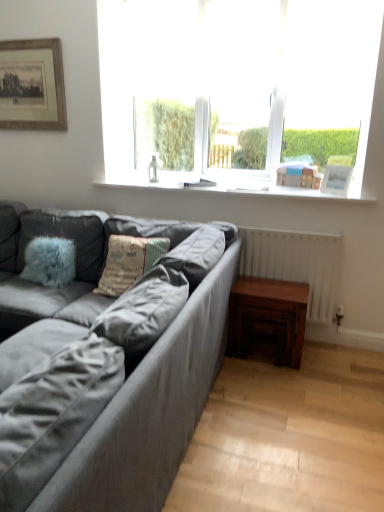
What do you see at coordinates (227, 187) in the screenshot? I see `white plastic window sill at upper center` at bounding box center [227, 187].

How much space does white glossy picture frame at upper right, the 1th picture frame when ordered from right to left, occupy horizontally?

8.96 centimeters.

Measure the distance between point (x=248, y=2) and camera.

Point (x=248, y=2) and camera are 9.29 feet apart from each other.

At what (x,y) coordinates should I click in order to perform the action: click on transparent glass window at upper center. Please return your answer as a coordinate pair (x, y). Looking at the image, I should click on (235, 75).

Image resolution: width=384 pixels, height=512 pixels. I want to click on white plastic window sill at upper center, so click(x=227, y=187).

Which object is further away from the camera taking this photo, textured fabric pillow at center or suede gray couch at left?

textured fabric pillow at center is behind.

Looking at this image, is suede gray couch at left surrounded by textured fabric pillow at center?

Definitely not — suede gray couch at left is not inside textured fabric pillow at center.

From the image's perspective, is suede gray couch at left beneath wooden framed print at upper left, which ranks as the 2th picture frame in front-to-back order?

Yes, from the image's perspective, suede gray couch at left is below wooden framed print at upper left, which ranks as the 2th picture frame in front-to-back order.

Is suede gray couch at left not close to wooden framed print at upper left, which ranks as the 2th picture frame in front-to-back order?

Yes, suede gray couch at left and wooden framed print at upper left, which ranks as the 2th picture frame in front-to-back order, are quite far apart.

Is suede gray couch at left facing away from wooden framed print at upper left, the 1th picture frame positioned from the left?

suede gray couch at left is not turned away from wooden framed print at upper left, the 1th picture frame positioned from the left.

What's the angular difference between suede gray couch at left and wooden framed print at upper left, the second picture frame positioned from the right,'s facing directions?

89.8 degrees.

From the image's perspective, is dark brown wooden table at lower right on white plastic window sill at upper center?

No, from the image's perspective, dark brown wooden table at lower right is not above white plastic window sill at upper center.

Is dark brown wooden table at lower right turned away from white plastic window sill at upper center?

No.

Are dark brown wooden table at lower right and white plastic window sill at upper center beside each other?

dark brown wooden table at lower right and white plastic window sill at upper center are clearly separated.

Considering the relative sizes of dark brown wooden table at lower right and white plastic window sill at upper center in the image provided, is dark brown wooden table at lower right wider than white plastic window sill at upper center?

No.

Considering the sizes of objects textured fabric pillow at center and dark brown wooden table at lower right in the image provided, who is wider, textured fabric pillow at center or dark brown wooden table at lower right?

With larger width is dark brown wooden table at lower right.

Which of these two, textured fabric pillow at center or dark brown wooden table at lower right, is smaller?

textured fabric pillow at center is smaller.

Is textured fabric pillow at center taller or shorter than dark brown wooden table at lower right?

In the image, textured fabric pillow at center appears to be taller than dark brown wooden table at lower right.

In terms of size, does white glossy picture frame at upper right, which is counted as the first picture frame, starting from the bottom, appear bigger or smaller than dark brown wooden table at lower right?

In the image, white glossy picture frame at upper right, which is counted as the first picture frame, starting from the bottom, appears to be smaller than dark brown wooden table at lower right.

Would you consider white glossy picture frame at upper right, the 1th picture frame when ordered from right to left, to be distant from dark brown wooden table at lower right?

No.

Considering the sizes of white glossy picture frame at upper right, which ranks as the 2th picture frame in left-to-right order, and dark brown wooden table at lower right in the image, is white glossy picture frame at upper right, which ranks as the 2th picture frame in left-to-right order, taller or shorter than dark brown wooden table at lower right?

Clearly, white glossy picture frame at upper right, which ranks as the 2th picture frame in left-to-right order, is shorter compared to dark brown wooden table at lower right.

Find the location of `table lying on the left of white glossy picture frame at upper right, marked as the first picture frame in a front-to-back arrangement`. table lying on the left of white glossy picture frame at upper right, marked as the first picture frame in a front-to-back arrangement is located at coordinates (268, 316).

Can you confirm if dark brown wooden table at lower right is wider than transparent glass window at upper center?

Yes, dark brown wooden table at lower right is wider than transparent glass window at upper center.

In the image, is dark brown wooden table at lower right on the left side or the right side of transparent glass window at upper center?

dark brown wooden table at lower right is positioned on transparent glass window at upper center's right side.

Based on the photo, what's the angular difference between dark brown wooden table at lower right and transparent glass window at upper center's facing directions?

0.853 degrees.

You are a GUI agent. You are given a task and a screenshot of the screen. Output one action in this format:
    pyautogui.click(x=<x>, y=<y>)
    Task: Click on the table that appears below the transparent glass window at upper center (from the image's perspective)
    The width and height of the screenshot is (384, 512).
    Given the screenshot: What is the action you would take?
    pyautogui.click(x=268, y=316)

Considering the sizes of objects transparent glass window at upper center and dark brown wooden table at lower right in the image provided, who is bigger, transparent glass window at upper center or dark brown wooden table at lower right?

With larger size is transparent glass window at upper center.

From a real-world perspective, which object rests below the other?

dark brown wooden table at lower right is physically lower.

Considering the sizes of transparent glass window at upper center and dark brown wooden table at lower right in the image, is transparent glass window at upper center taller or shorter than dark brown wooden table at lower right?

Considering their sizes, transparent glass window at upper center has more height than dark brown wooden table at lower right.

Where is `pillow above the suede gray couch at left (from a real-world perspective)`? Image resolution: width=384 pixels, height=512 pixels. pillow above the suede gray couch at left (from a real-world perspective) is located at coordinates (128, 262).

Locate an element on the screen. picture frame that is on the left side of suede gray couch at left is located at coordinates (x=32, y=85).

From the image, which object appears to be farther from transparent glass window at upper center, wooden framed print at upper left, the second picture frame positioned from the right, or suede gray couch at left?

Among the two, suede gray couch at left is located further to transparent glass window at upper center.

From the image, which object appears to be nearer to white plastic window sill at upper center, suede gray couch at left or wooden framed print at upper left, which is counted as the 1th picture frame, starting from the top?

wooden framed print at upper left, which is counted as the 1th picture frame, starting from the top.

Looking at the image, which one is located further to textured fabric pillow at center, white plastic window sill at upper center or white glossy picture frame at upper right, marked as the first picture frame in a front-to-back arrangement?

The object further to textured fabric pillow at center is white glossy picture frame at upper right, marked as the first picture frame in a front-to-back arrangement.

Looking at the image, which one is located further to white glossy picture frame at upper right, arranged as the 2th picture frame when viewed from the back, dark brown wooden table at lower right or white plastic window sill at upper center?

The object further to white glossy picture frame at upper right, arranged as the 2th picture frame when viewed from the back, is dark brown wooden table at lower right.

Based on their spatial positions, is white plastic window sill at upper center or textured fabric pillow at center closer to wooden framed print at upper left, which is counted as the 1th picture frame, starting from the top?

white plastic window sill at upper center.

Looking at the image, which one is located closer to white plastic window sill at upper center, wooden framed print at upper left, arranged as the second picture frame when ordered from the bottom, or textured fabric pillow at center?

The object closer to white plastic window sill at upper center is textured fabric pillow at center.

Considering their positions, is wooden framed print at upper left, arranged as the second picture frame when ordered from the bottom, positioned closer to transparent glass window at upper center than textured fabric pillow at center?

wooden framed print at upper left, arranged as the second picture frame when ordered from the bottom, lies closer to transparent glass window at upper center than the other object.

Looking at the image, which one is located closer to transparent glass window at upper center, wooden framed print at upper left, the 1th picture frame positioned from the left, or white plastic window sill at upper center?

white plastic window sill at upper center is positioned closer to the anchor transparent glass window at upper center.

The image size is (384, 512). I want to click on picture frame between transparent glass window at upper center and dark brown wooden table at lower right from top to bottom, so (x=336, y=179).

Locate an element on the screen. The height and width of the screenshot is (512, 384). table between suede gray couch at left and white plastic window sill at upper center from front to back is located at coordinates (268, 316).

Find the location of a particular element. The image size is (384, 512). pillow between wooden framed print at upper left, the second picture frame positioned from the right, and transparent glass window at upper center is located at coordinates (128, 262).

Where is `table between suede gray couch at left and transparent glass window at upper center along the z-axis`? The image size is (384, 512). table between suede gray couch at left and transparent glass window at upper center along the z-axis is located at coordinates (268, 316).